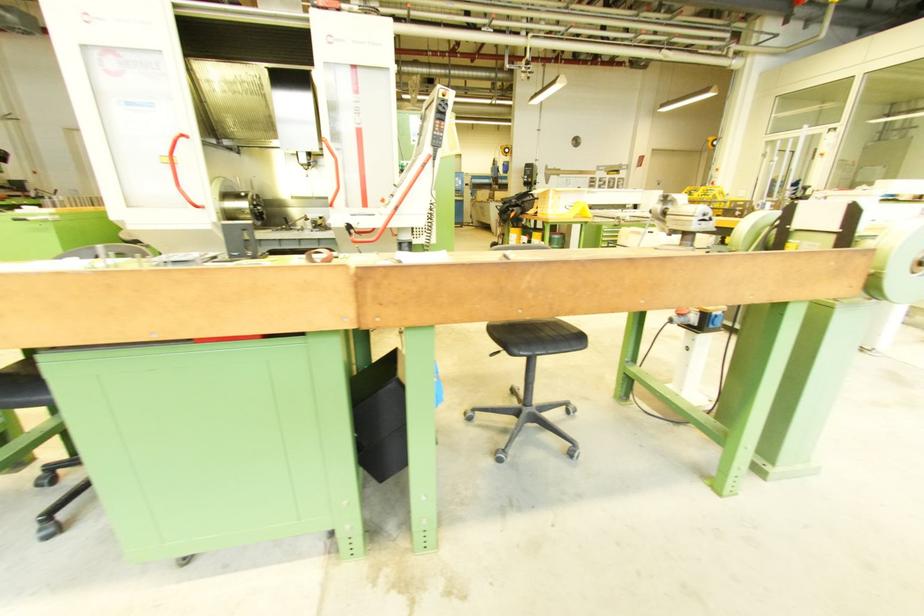
Locate an element on the screen. Image resolution: width=924 pixels, height=616 pixels. pendant joystick is located at coordinates (319, 254).